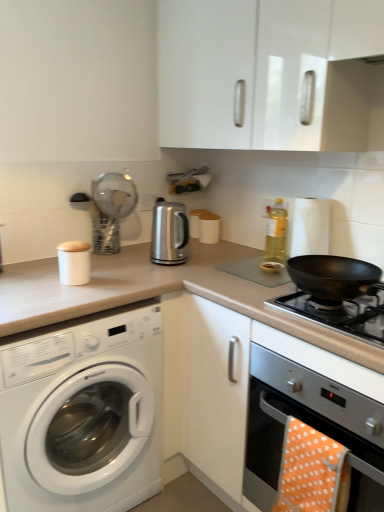
Question: Is satin silver oven at lower right not close to yellow translucent bottle at upper right?

Choices:
 (A) no
 (B) yes

Answer: (A)

Question: From the image's perspective, does satin silver oven at lower right appear lower than yellow translucent bottle at upper right?

Choices:
 (A) no
 (B) yes

Answer: (B)

Question: Is satin silver oven at lower right taller than yellow translucent bottle at upper right?

Choices:
 (A) yes
 (B) no

Answer: (A)

Question: Is yellow translucent bottle at upper right completely or partially inside satin silver oven at lower right?

Choices:
 (A) no
 (B) yes

Answer: (A)

Question: Does satin silver oven at lower right have a smaller size compared to yellow translucent bottle at upper right?

Choices:
 (A) no
 (B) yes

Answer: (A)

Question: Looking at their shapes, would you say white matte container at upper left, arranged as the 1th appliance when viewed from the left, is wider or thinner than black matte wok at right?

Choices:
 (A) thin
 (B) wide

Answer: (A)

Question: Is white matte container at upper left, arranged as the 1th appliance when viewed from the left, to the left or to the right of black matte wok at right in the image?

Choices:
 (A) right
 (B) left

Answer: (B)

Question: Would you say white matte container at upper left, arranged as the 1th appliance when viewed from the left, is inside or outside black matte wok at right?

Choices:
 (A) outside
 (B) inside

Answer: (A)

Question: Is point (82, 269) positioned closer to the camera than point (334, 292)?

Choices:
 (A) closer
 (B) farther

Answer: (B)

Question: In the image, is yellow translucent bottle at upper right on the left side or the right side of white matte container at upper left, acting as the fourth appliance starting from the right?

Choices:
 (A) right
 (B) left

Answer: (A)

Question: Looking at the image, does yellow translucent bottle at upper right seem bigger or smaller compared to white matte container at upper left, acting as the fourth appliance starting from the right?

Choices:
 (A) small
 (B) big

Answer: (B)

Question: Is yellow translucent bottle at upper right wider or thinner than white matte container at upper left, arranged as the 1th appliance when viewed from the left?

Choices:
 (A) wide
 (B) thin

Answer: (B)

Question: Considering their positions, is yellow translucent bottle at upper right located in front of or behind white matte container at upper left, arranged as the 1th appliance when viewed from the left?

Choices:
 (A) behind
 (B) front

Answer: (A)

Question: Is point (127, 197) closer or farther from the camera than point (87, 282)?

Choices:
 (A) farther
 (B) closer

Answer: (A)

Question: Is metal mesh strainer at upper center, the third appliance when ordered from right to left, wider or thinner than white matte container at upper left, acting as the fourth appliance starting from the right?

Choices:
 (A) wide
 (B) thin

Answer: (A)